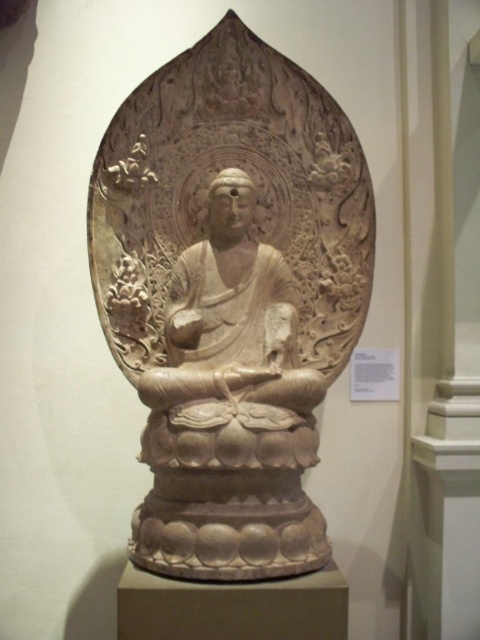
Looking at this image, is beige stone buddha at center wider than white stone statue at center?

Indeed, beige stone buddha at center has a greater width compared to white stone statue at center.

Looking at this image, is beige stone buddha at center bigger than white stone statue at center?

Actually, beige stone buddha at center might be smaller than white stone statue at center.

Who is more forward, (323, 122) or (214, 444)?

Point (214, 444) is more forward.

This screenshot has height=640, width=480. I want to click on beige stone buddha at center, so click(229, 298).